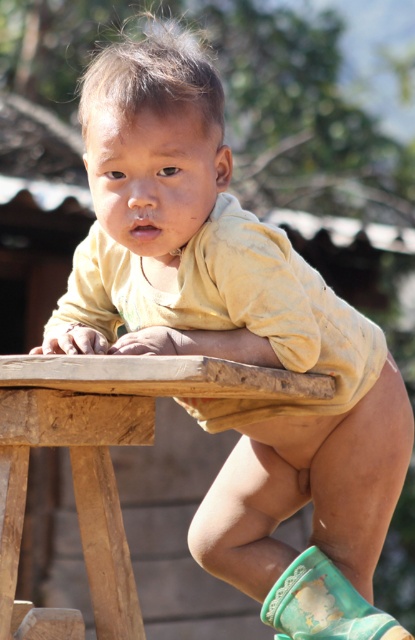
You are a photographer trying to capture the child standing on the wooden table at center. You notice the green rubber boot at lower right. Since you want to focus on the child, should you adjust your camera to avoid the boot being in the frame?

The wooden table at center is wider than the green rubber boot at lower right, so adjusting the camera angle to focus on the child on the table would likely exclude the boot at the edge of the frame.